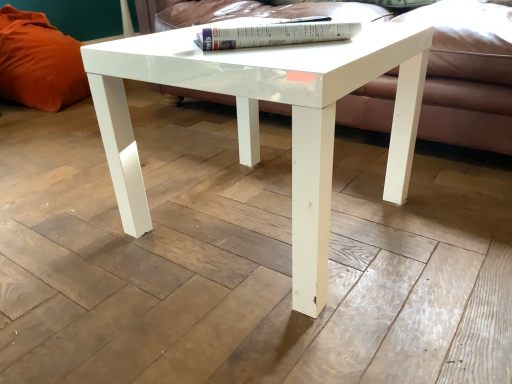
Question: Is white glossy book at upper center looking in the opposite direction of white glossy coffee table at center?

Choices:
 (A) yes
 (B) no

Answer: (B)

Question: Is white glossy book at upper center at the right side of white glossy coffee table at center?

Choices:
 (A) no
 (B) yes

Answer: (B)

Question: Could you tell me if white glossy book at upper center is turned towards white glossy coffee table at center?

Choices:
 (A) yes
 (B) no

Answer: (B)

Question: Considering the relative sizes of white glossy book at upper center and white glossy coffee table at center in the image provided, is white glossy book at upper center wider than white glossy coffee table at center?

Choices:
 (A) no
 (B) yes

Answer: (A)

Question: Would you say white glossy book at upper center contains white glossy coffee table at center?

Choices:
 (A) yes
 (B) no

Answer: (B)

Question: Is white glossy book at upper center in contact with white glossy coffee table at center?

Choices:
 (A) no
 (B) yes

Answer: (A)

Question: Is the position of white glossy coffee table at center more distant than that of orange fabric pillow at left?

Choices:
 (A) yes
 (B) no

Answer: (B)

Question: Would you consider white glossy coffee table at center to be distant from orange fabric pillow at left?

Choices:
 (A) yes
 (B) no

Answer: (A)

Question: From a real-world perspective, does white glossy coffee table at center stand above orange fabric pillow at left?

Choices:
 (A) yes
 (B) no

Answer: (B)

Question: Is white glossy coffee table at center closer to the viewer compared to orange fabric pillow at left?

Choices:
 (A) no
 (B) yes

Answer: (B)

Question: Is white glossy coffee table at center aimed at orange fabric pillow at left?

Choices:
 (A) yes
 (B) no

Answer: (B)

Question: Does white glossy coffee table at center have a lesser height compared to orange fabric pillow at left?

Choices:
 (A) no
 (B) yes

Answer: (B)

Question: From the image's perspective, is matte white couch at center located above white glossy book at upper center?

Choices:
 (A) yes
 (B) no

Answer: (A)